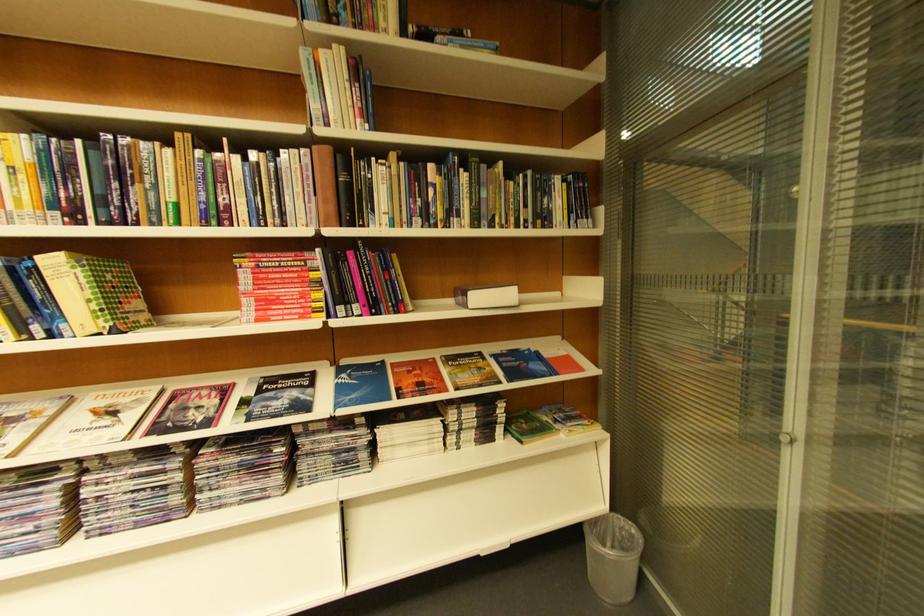
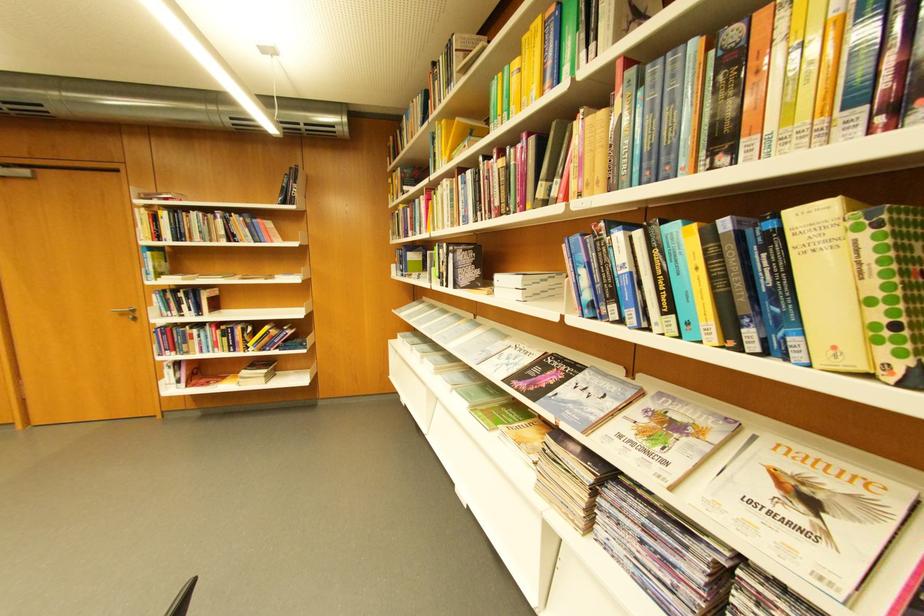
Locate, in the second image, the point that corresponds to [46,259] in the first image.

(796, 214)